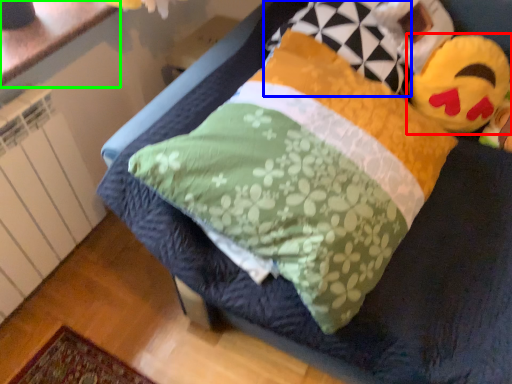
Question: Which object is positioned farthest from toy (highlighted by a red box)? Select from pillow (highlighted by a blue box) and counter top (highlighted by a green box).

Choices:
 (A) pillow
 (B) counter top

Answer: (B)